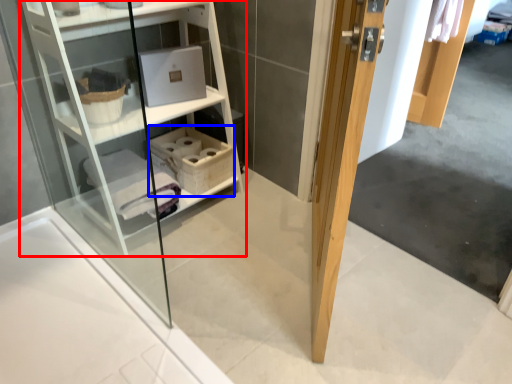
Question: Among these objects, which one is farthest to the camera, shelf (highlighted by a red box) or basket (highlighted by a blue box)?

Choices:
 (A) shelf
 (B) basket

Answer: (B)